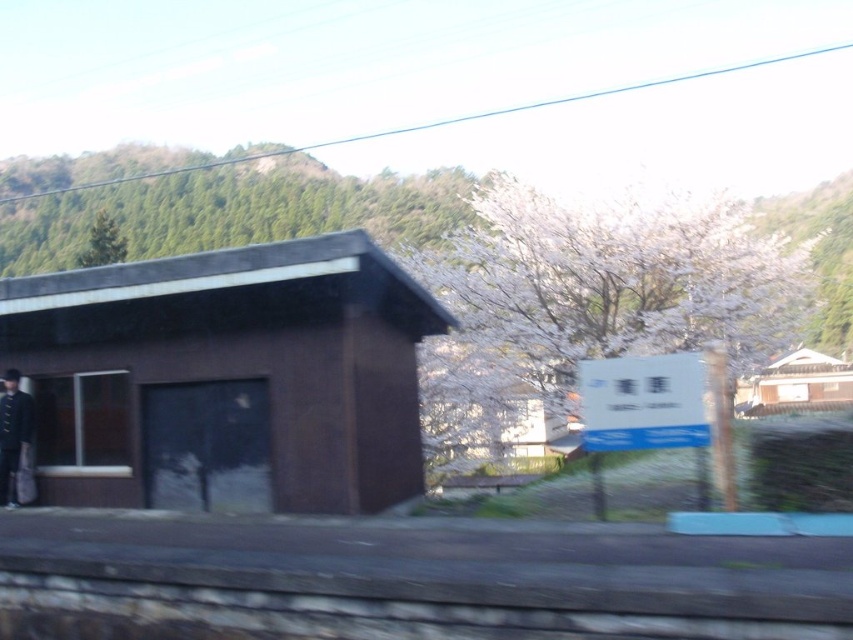
Question: Considering the real-world distances, which object is closest to the brown matte hut at left?

Choices:
 (A) dark brown leather coat at left
 (B) white wooden house at upper right

Answer: (A)

Question: Is brown matte hut at left smaller than dark brown leather coat at left?

Choices:
 (A) yes
 (B) no

Answer: (A)

Question: Which object is the farthest from the brown matte hut at left?

Choices:
 (A) white wooden house at upper right
 (B) dark brown leather coat at left

Answer: (A)

Question: Does brown matte hut at left lie behind white wooden house at upper right?

Choices:
 (A) yes
 (B) no

Answer: (B)

Question: Is white wooden house at upper right positioned at the back of dark brown leather coat at left?

Choices:
 (A) yes
 (B) no

Answer: (A)

Question: Which object is the closest to the brown matte hut at left?

Choices:
 (A) dark brown leather coat at left
 (B) white wooden house at upper right

Answer: (A)